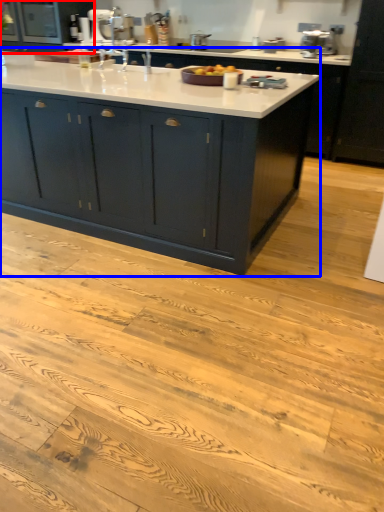
Question: Which point is further to the camera, cabinetry (highlighted by a red box) or cabinetry (highlighted by a blue box)?

Choices:
 (A) cabinetry
 (B) cabinetry

Answer: (A)